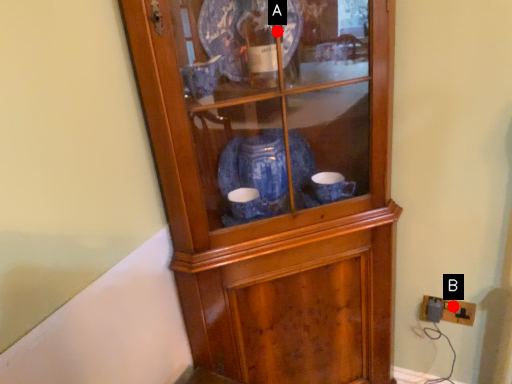
Question: Two points are circled on the image, labeled by A and B beside each circle. Which point is closer to the camera?

Choices:
 (A) A is closer
 (B) B is closer

Answer: (A)